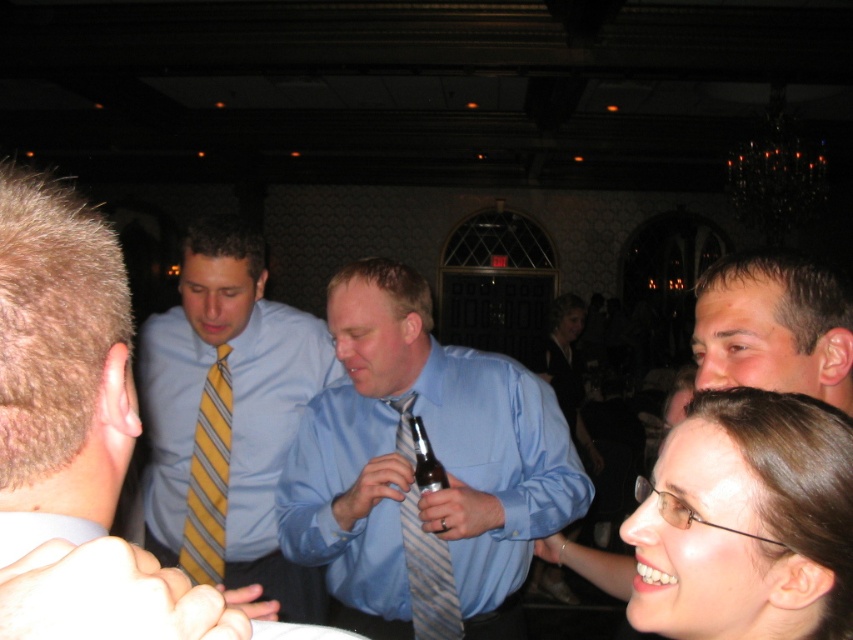
Which is above, yellow striped tie at left or striped fabric tie at center?

yellow striped tie at left

Does yellow striped tie at left lie behind striped fabric tie at center?

No, yellow striped tie at left is in front of striped fabric tie at center.

At what (x,y) coordinates should I click in order to perform the action: click on yellow striped tie at left. Please return your answer as a coordinate pair (x, y). The width and height of the screenshot is (853, 640). Looking at the image, I should click on (61, 353).

Can you confirm if blue satin shirt at center is taller than yellow striped tie at left?

Correct, blue satin shirt at center is much taller as yellow striped tie at left.

Is point (198, 540) farther from camera compared to point (48, 284)?

Yes, point (198, 540) is farther from viewer.

You are a GUI agent. You are given a task and a screenshot of the screen. Output one action in this format:
    pyautogui.click(x=<x>, y=<y>)
    Task: Click on the blue satin shirt at center
    Image resolution: width=853 pixels, height=640 pixels.
    Given the screenshot: What is the action you would take?
    pyautogui.click(x=227, y=417)

Does blue silk shirt at center appear on the right side of smooth brown hair at lower right?

In fact, blue silk shirt at center is to the left of smooth brown hair at lower right.

Does blue silk shirt at center have a larger size compared to smooth brown hair at lower right?

Indeed, blue silk shirt at center has a larger size compared to smooth brown hair at lower right.

Is point (538, 477) farther from camera compared to point (780, 500)?

That is True.

Where is `blue silk shirt at center`? blue silk shirt at center is located at coordinates (412, 468).